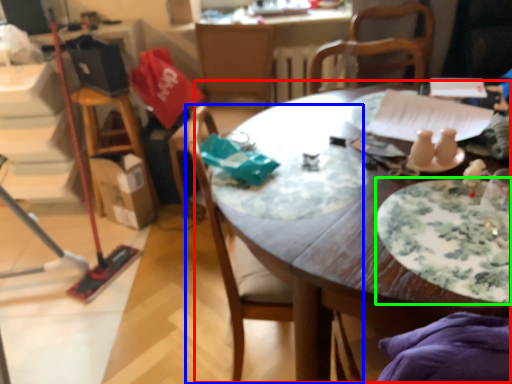
Question: Considering the real-world distances, which object is farthest from table (highlighted by a red box)? chair (highlighted by a blue box) or plate (highlighted by a green box)?

Choices:
 (A) chair
 (B) plate

Answer: (B)